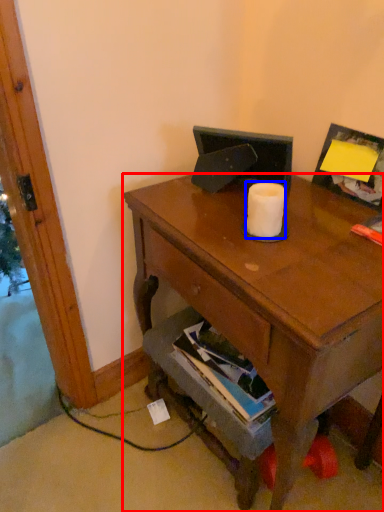
Question: Which object appears farthest to the camera in this image, desk (highlighted by a red box) or toilet paper (highlighted by a blue box)?

Choices:
 (A) desk
 (B) toilet paper

Answer: (B)